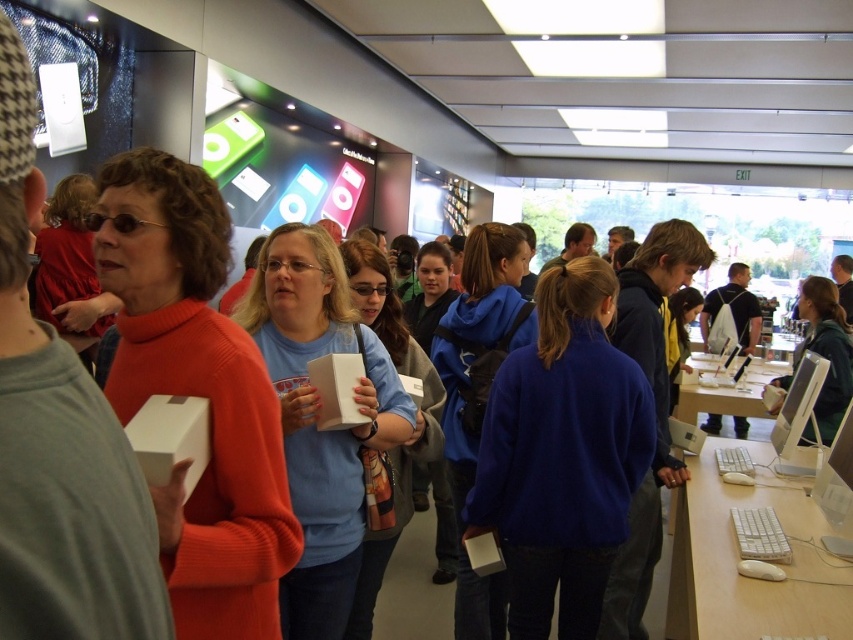
Question: Does royal blue sweater at center appear on the right side of white matte box at center?

Choices:
 (A) yes
 (B) no

Answer: (A)

Question: Considering the relative positions of royal blue sweater at center and white matte box at center in the image provided, where is royal blue sweater at center located with respect to white matte box at center?

Choices:
 (A) left
 (B) right

Answer: (B)

Question: Among these points, which one is nearest to the camera?

Choices:
 (A) (399, 426)
 (B) (636, 460)

Answer: (A)

Question: Considering the relative positions of royal blue sweater at center and white matte box at center in the image provided, where is royal blue sweater at center located with respect to white matte box at center?

Choices:
 (A) left
 (B) right

Answer: (B)